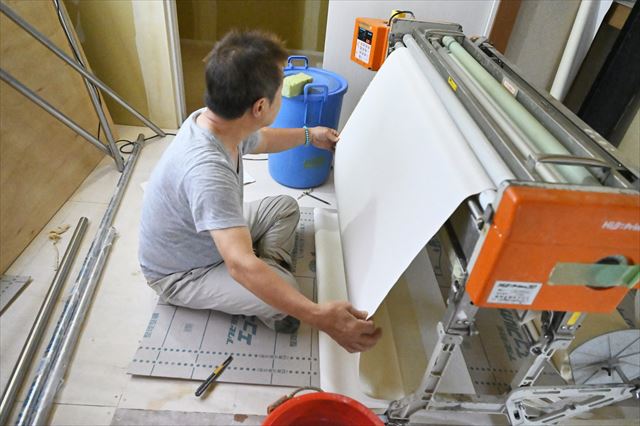
The height and width of the screenshot is (426, 640). Find the location of `garbage can`. garbage can is located at coordinates (298, 111).